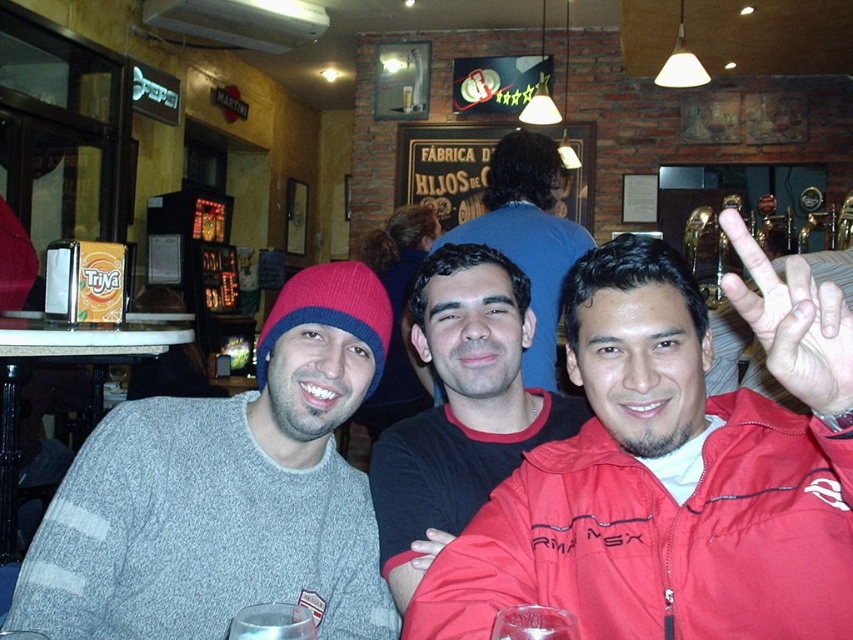
Question: Does black matte shirt at center have a greater width compared to smooth black shirt at center?

Choices:
 (A) yes
 (B) no

Answer: (B)

Question: Can you confirm if gray knit beanie at upper left is bigger than matte red hand at center right?

Choices:
 (A) no
 (B) yes

Answer: (B)

Question: Among these objects, which one is nearest to the camera?

Choices:
 (A) red matte jacket at center
 (B) gray knit beanie at upper left
 (C) black matte shirt at center

Answer: (A)

Question: Which object appears farthest from the camera in this image?

Choices:
 (A) matte black hand at center
 (B) black matte shirt at center
 (C) matte red hand at center right
 (D) gray knit beanie at upper left

Answer: (A)

Question: Estimate the real-world distances between objects in this image. Which object is farther from the matte red hand at center right?

Choices:
 (A) black matte shirt at center
 (B) gray knit beanie at upper left
 (C) red matte jacket at center
 (D) matte black hand at center

Answer: (B)

Question: Is the position of gray knit beanie at upper left less distant than that of black matte shirt at center?

Choices:
 (A) no
 (B) yes

Answer: (B)